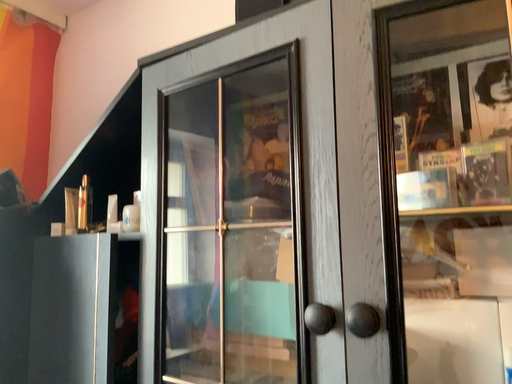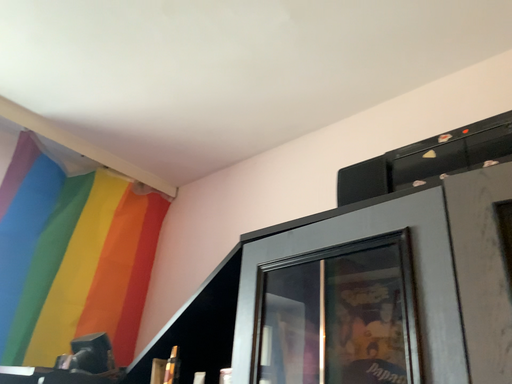
Question: Which way did the camera rotate in the video?

Choices:
 (A) rotated downward
 (B) rotated upward

Answer: (B)